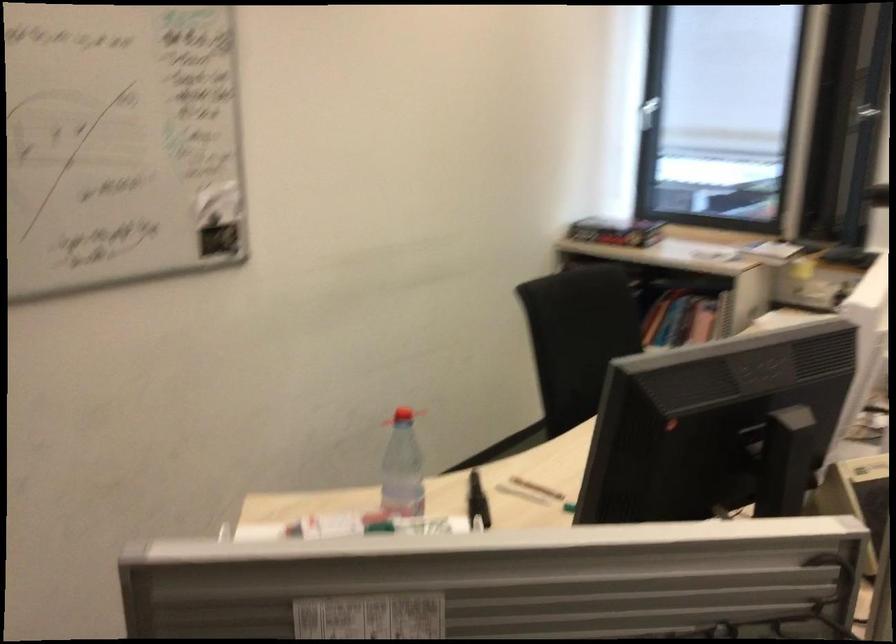
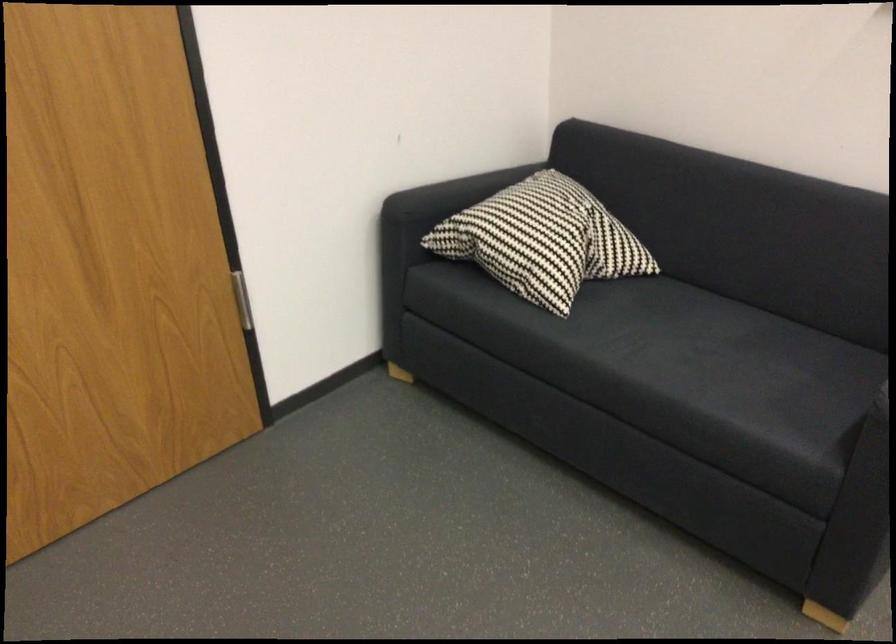
The first image is from the beginning of the video and the second image is from the end. How did the camera likely rotate when shooting the video?

The rotation direction of the camera is left-down.